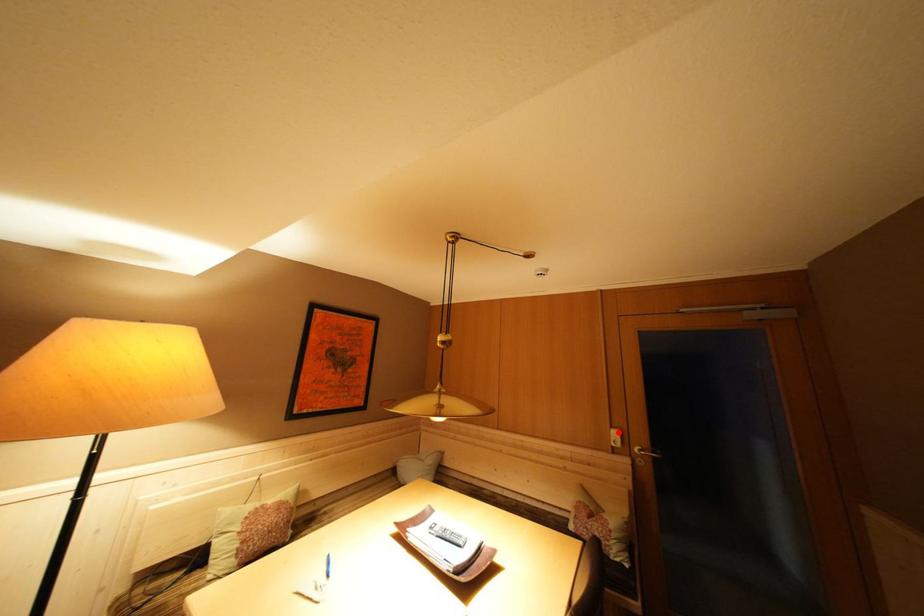
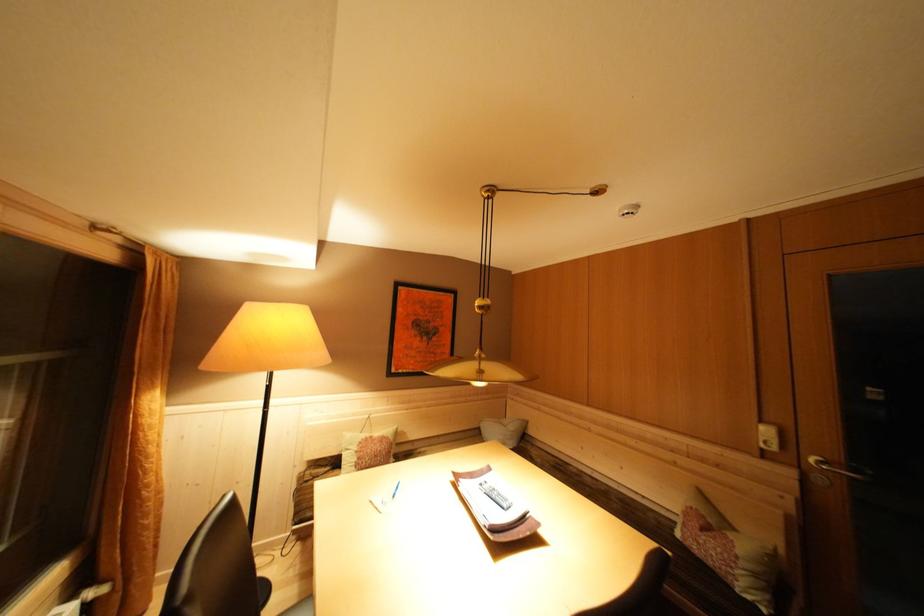
Where in the second image is the point corresponding to the highlighted location from the first image?

(768, 427)